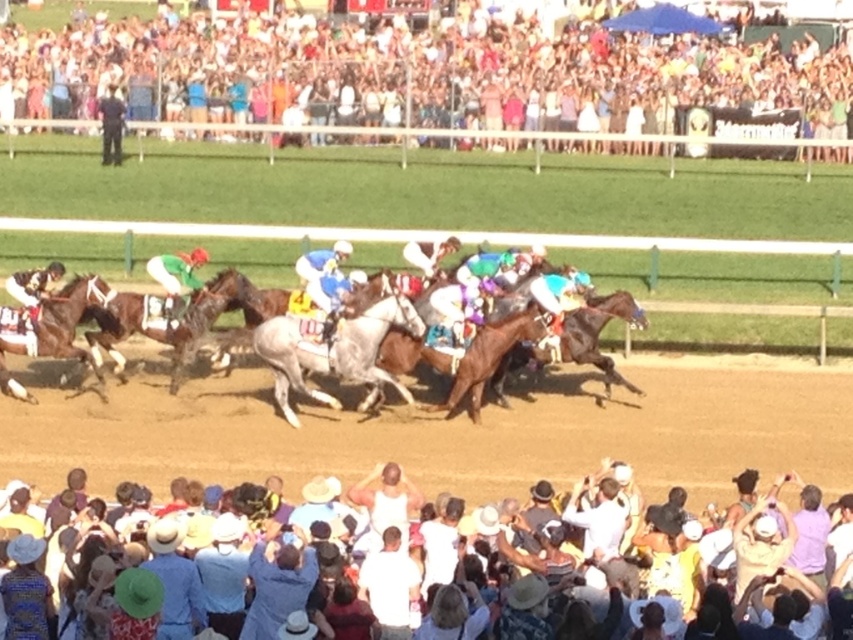
Question: Which object is the farthest from the multicolored fabric crowd at upper center?

Choices:
 (A) white cotton crowd at lower center
 (B) brown glossy horse at center
 (C) green jersey at center
 (D) white tank top at center

Answer: (D)

Question: Which of the following is the farthest from the observer?

Choices:
 (A) multicolored fabric crowd at upper center
 (B) brown glossy horse at center
 (C) white tank top at center

Answer: (A)

Question: Does multicolored fabric crowd at upper center lie behind white cotton shirt at center?

Choices:
 (A) no
 (B) yes

Answer: (B)

Question: Can you confirm if green jersey at center is positioned above white cotton crowd at lower center?

Choices:
 (A) no
 (B) yes

Answer: (B)

Question: Which point is closer to the camera taking this photo?

Choices:
 (A) (590, 36)
 (B) (44, 484)

Answer: (B)

Question: Is green jersey at center to the right of white cotton crowd at lower center from the viewer's perspective?

Choices:
 (A) yes
 (B) no

Answer: (B)